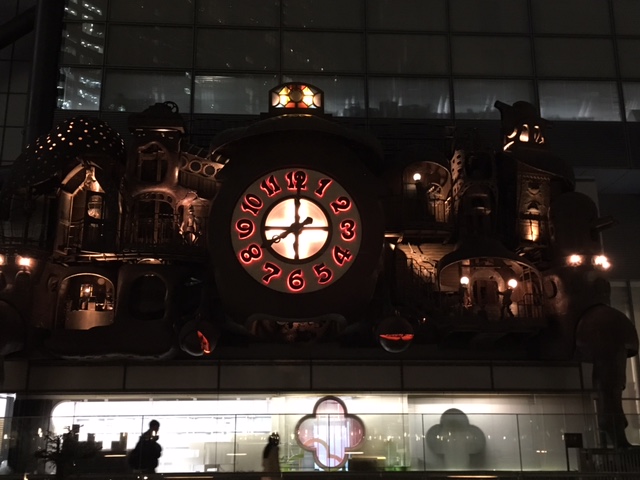
Locate an element on the screen. mirror is located at coordinates (337, 434).